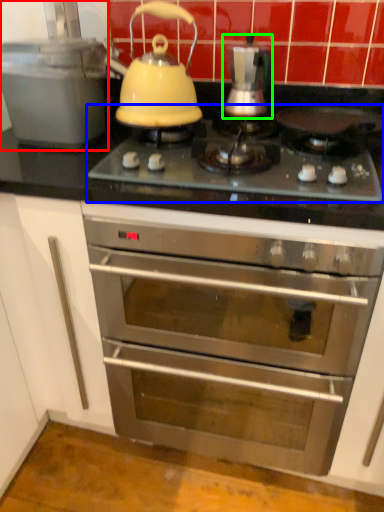
Question: Which is nearer to the kitchen appliance (highlighted by a red box)? gas stove (highlighted by a blue box) or kitchen appliance (highlighted by a green box).

Choices:
 (A) gas stove
 (B) kitchen appliance

Answer: (A)